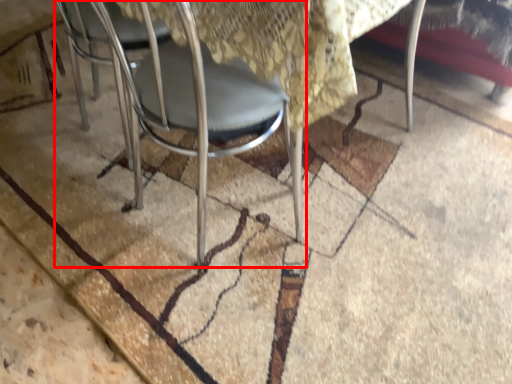
Question: From the image's perspective, considering the relative positions of chair (annotated by the red box) and mat in the image provided, where is chair (annotated by the red box) located with respect to the staircase?

Choices:
 (A) below
 (B) above

Answer: (A)